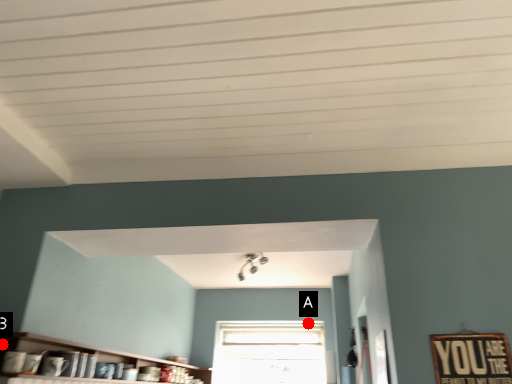
Question: Two points are circled on the image, labeled by A and B beside each circle. Which point is closer to the camera taking this photo?

Choices:
 (A) A is closer
 (B) B is closer

Answer: (B)